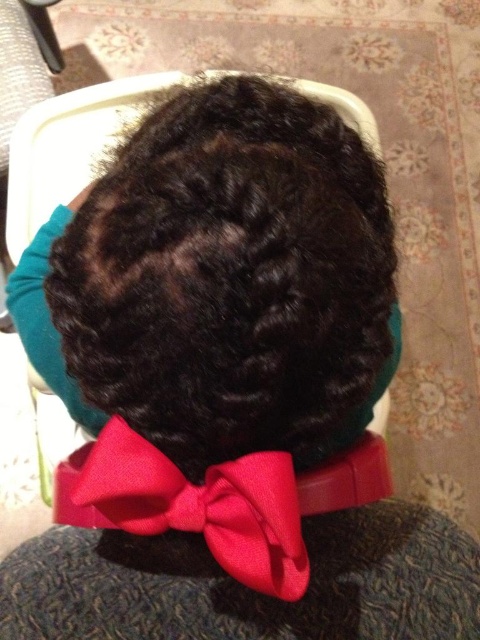
Question: Is curly dark brown hair at center to the right of shiny red bow tie at center from the viewer's perspective?

Choices:
 (A) no
 (B) yes

Answer: (B)

Question: Which point is farther to the camera?

Choices:
 (A) curly dark brown hair at center
 (B) shiny red bow tie at center

Answer: (B)

Question: Is curly dark brown hair at center positioned in front of shiny red bow tie at center?

Choices:
 (A) no
 (B) yes

Answer: (B)

Question: Is curly dark brown hair at center thinner than shiny red bow tie at center?

Choices:
 (A) no
 (B) yes

Answer: (A)

Question: Which object is farther from the camera taking this photo?

Choices:
 (A) curly dark brown hair at center
 (B) shiny red bow tie at center

Answer: (B)